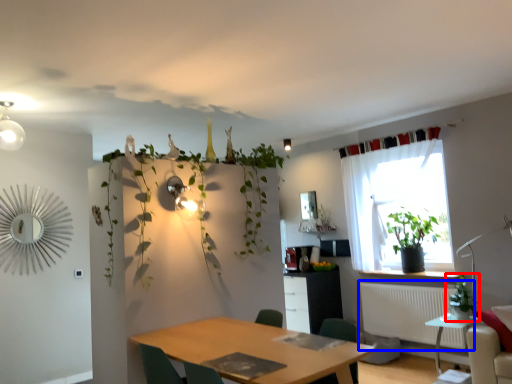
Question: Which of the following is the farthest to the observer, houseplant (highlighted by a red box) or radiator (highlighted by a blue box)?

Choices:
 (A) houseplant
 (B) radiator

Answer: (B)